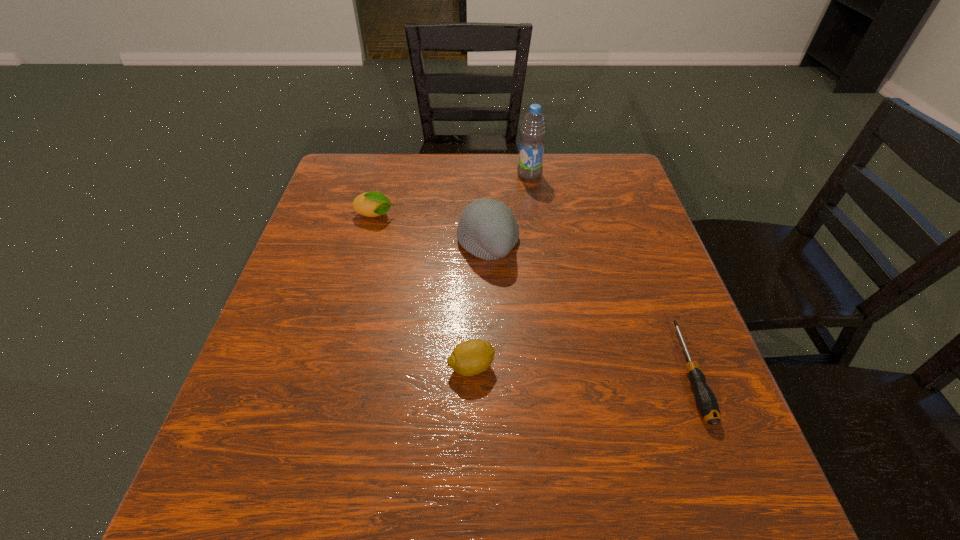
Identify the location of water bottle. The image size is (960, 540). (533, 130).

Locate an element on the screen. This screenshot has height=540, width=960. the tallest object is located at coordinates (533, 130).

This screenshot has width=960, height=540. Identify the location of the fourth shortest object. [488, 229].

Where is `the left lemon`? The image size is (960, 540). the left lemon is located at coordinates (371, 204).

In order to click on the leftmost object in this screenshot , I will do `click(371, 204)`.

Find the location of a particular element. the nearer lemon is located at coordinates (471, 357).

You are a GUI agent. You are given a task and a screenshot of the screen. Output one action in this format:
    pyautogui.click(x=<x>, y=<y>)
    Task: Click on the right lemon
    
    Given the screenshot: What is the action you would take?
    pyautogui.click(x=471, y=357)

The width and height of the screenshot is (960, 540). I want to click on the shortest object, so click(706, 402).

Image resolution: width=960 pixels, height=540 pixels. I want to click on screwdriver, so click(x=706, y=402).

The height and width of the screenshot is (540, 960). I want to click on free space located on the left of the tallest object, so click(x=485, y=174).